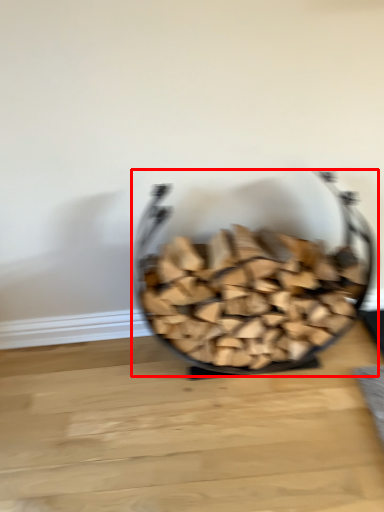
Question: From the image's perspective, what is the correct spatial relationship of tableware (annotated by the red box) in relation to table top?

Choices:
 (A) below
 (B) above

Answer: (B)